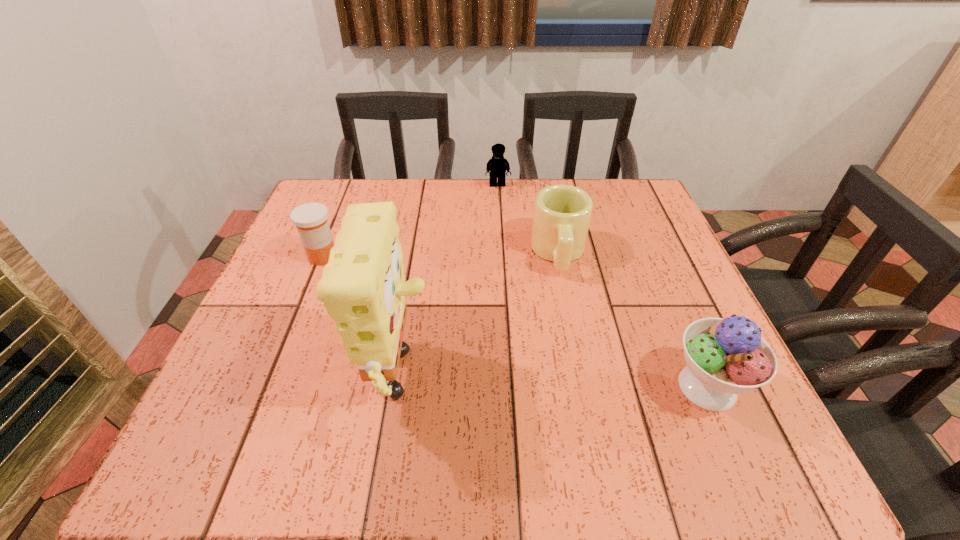
The image size is (960, 540). I want to click on object that ranks as the closest to the sponge, so click(311, 221).

You are a GUI agent. You are given a task and a screenshot of the screen. Output one action in this format:
    pyautogui.click(x=<x>, y=<y>)
    Task: Click on the vacant position in the image that satisfies the following two spatial constraints: 1. on the front side of the rightmost object; 2. on the left side of the medicine
    
    Given the screenshot: What is the action you would take?
    pyautogui.click(x=270, y=387)

At what (x,y) coordinates should I click in order to perform the action: click on free space that satisfies the following two spatial constraints: 1. on the front side of the icecream; 2. on the left side of the third object from left to right. Please return your answer as a coordinate pair (x, y). Image resolution: width=960 pixels, height=540 pixels. Looking at the image, I should click on (509, 387).

Find the location of a particular element. This screenshot has height=540, width=960. vacant space that satisfies the following two spatial constraints: 1. on the front side of the leftmost object; 2. on the face of the fourth object from right to left is located at coordinates (270, 386).